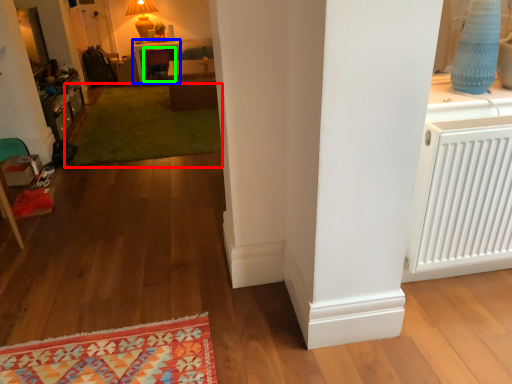
Question: Which object is the farthest from mat (highlighted by a red box)? Choose among these: table (highlighted by a blue box) or armchair (highlighted by a green box).

Choices:
 (A) table
 (B) armchair

Answer: (A)